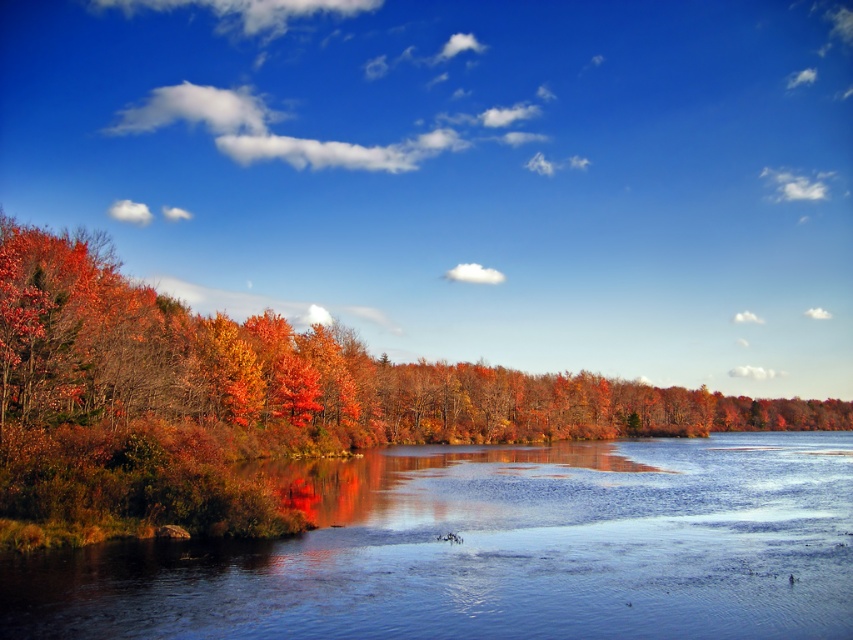
Between smooth reflective water at center and autumn leaves at left, which one is positioned higher?

smooth reflective water at center is above.

Does smooth reflective water at center have a smaller size compared to autumn leaves at left?

Yes, smooth reflective water at center is smaller than autumn leaves at left.

At what (x,y) coordinates should I click in order to perform the action: click on smooth reflective water at center. Please return your answer as a coordinate pair (x, y). Looking at the image, I should click on (492, 548).

Locate an element on the screen. smooth reflective water at center is located at coordinates (492, 548).